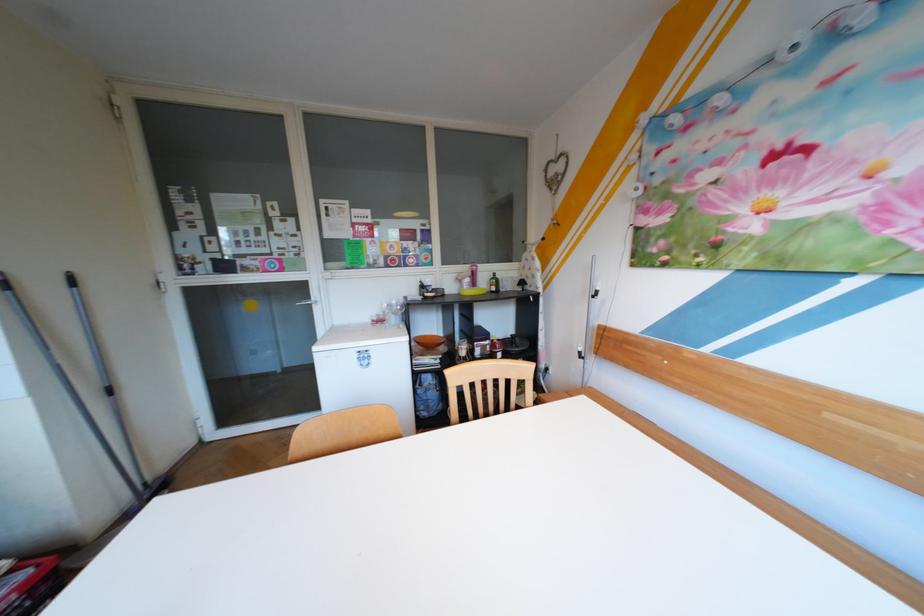
The height and width of the screenshot is (616, 924). In order to click on long cleaning pole in this screenshot , I will do `click(102, 371)`.